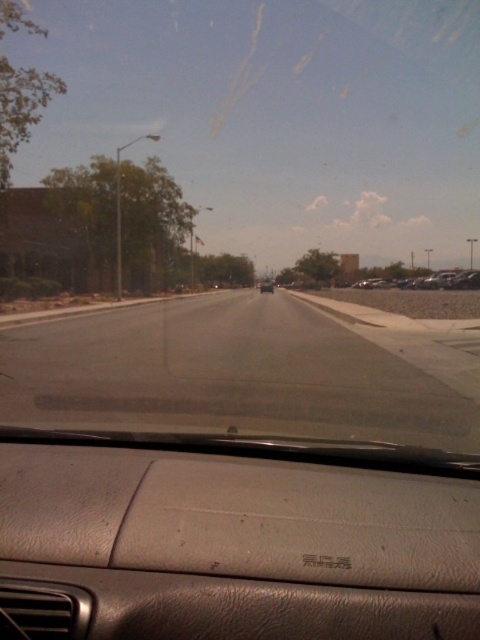
Is transparent glass windshield at center above metallic silver car at right?

Yes, transparent glass windshield at center is above metallic silver car at right.

Who is more forward, [84,428] or [436,285]?

Point [84,428]

Between point (83, 268) and point (467, 276), which one is positioned behind?

Positioned behind is point (83, 268).

You are a GUI agent. You are given a task and a screenshot of the screen. Output one action in this format:
    pyautogui.click(x=<x>, y=<y>)
    Task: Click on the transparent glass windshield at center
    This screenshot has height=640, width=480.
    Given the screenshot: What is the action you would take?
    pyautogui.click(x=238, y=216)

Looking at this image, can you confirm if transparent glass windshield at center is thinner than matte black sedan at center?

Incorrect, transparent glass windshield at center's width is not less than matte black sedan at center's.

Who is higher up, transparent glass windshield at center or matte black sedan at center?

transparent glass windshield at center

Does point (451, 248) come farther from viewer compared to point (263, 285)?

Yes, point (451, 248) is farther from viewer.

At what (x,y) coordinates should I click in order to perform the action: click on transparent glass windshield at center. Please return your answer as a coordinate pair (x, y). This screenshot has height=640, width=480. Looking at the image, I should click on (238, 216).

Does metallic silver car at right have a smaller size compared to matte black sedan at center?

Actually, metallic silver car at right might be larger than matte black sedan at center.

Does metallic silver car at right have a lesser height compared to matte black sedan at center?

Yes.

Where is `metallic silver car at right`? metallic silver car at right is located at coordinates (425, 282).